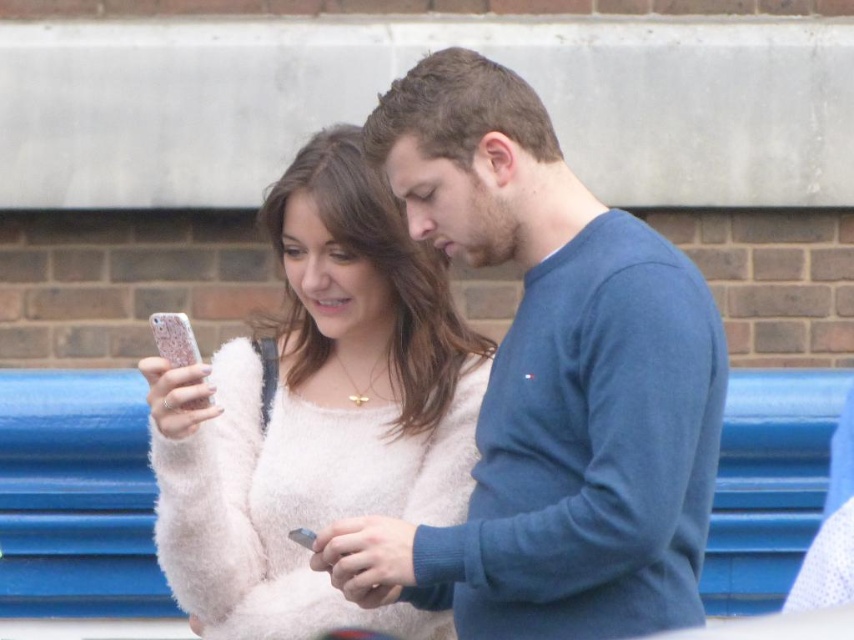
Is blue cotton sweater at center to the right of fuzzy white sweater at center from the viewer's perspective?

Yes, blue cotton sweater at center is to the right of fuzzy white sweater at center.

Which is more to the left, blue cotton sweater at center or fuzzy white sweater at center?

fuzzy white sweater at center

What are the coordinates of `blue cotton sweater at center` in the screenshot? It's located at (550, 385).